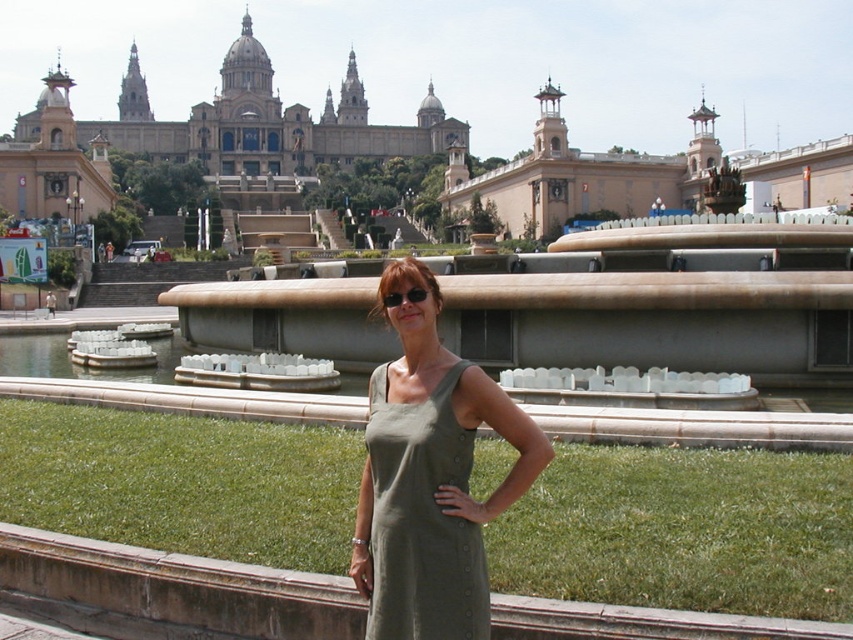
Who is positioned more to the right, green grass at center or sunglasses at center?

From the viewer's perspective, sunglasses at center appears more on the right side.

What do you see at coordinates (683, 531) in the screenshot? I see `green grass at center` at bounding box center [683, 531].

Does point (709, 518) lie in front of point (387, 296)?

No.

Where is `green grass at center`? Image resolution: width=853 pixels, height=640 pixels. green grass at center is located at coordinates (683, 531).

Which is behind, point (440, 592) or point (178, 147)?

Point (178, 147)

Can you confirm if olive green fabric dress at center is wider than beige stone palace at upper center?

No.

I want to click on olive green fabric dress at center, so click(430, 477).

Identify the location of olive green fabric dress at center. (430, 477).

Can you confirm if olive green fabric dress at center is positioned below sunglasses at center?

Yes.

Is olive green fabric dress at center to the right of sunglasses at center from the viewer's perspective?

Incorrect, olive green fabric dress at center is not on the right side of sunglasses at center.

Is point (378, 435) less distant than point (436, 291)?

Yes, it is in front of point (436, 291).

The image size is (853, 640). I want to click on olive green fabric dress at center, so click(430, 477).